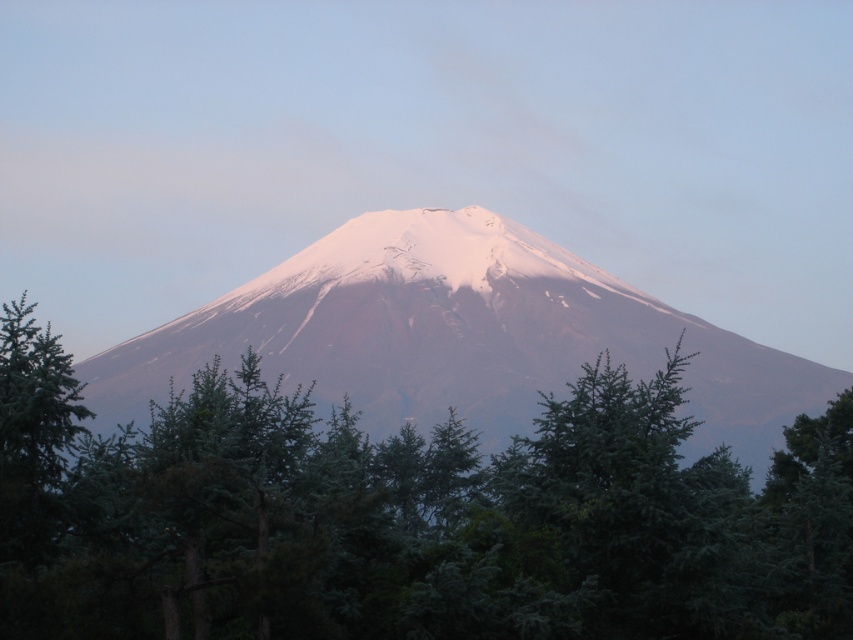
Describe the element at coordinates (405, 516) in the screenshot. I see `green textured trees at center` at that location.

Does green textured trees at center appear on the right side of white snow-covered mountain at center?

Correct, you'll find green textured trees at center to the right of white snow-covered mountain at center.

Between point (402, 600) and point (811, 369), which one is positioned in front?

Point (402, 600)

Where is `green textured trees at center`? green textured trees at center is located at coordinates (405, 516).